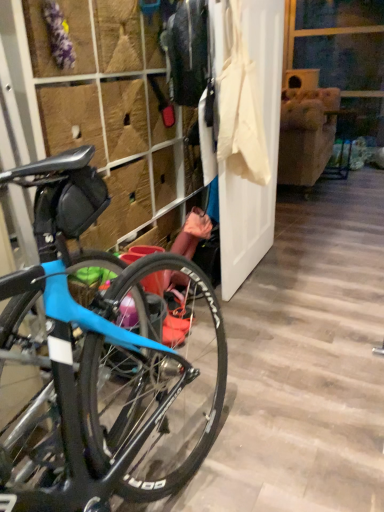
Question: Considering the relative positions of white fabric screen door at center and blue matte bicycle at left in the image provided, is white fabric screen door at center to the left or to the right of blue matte bicycle at left?

Choices:
 (A) left
 (B) right

Answer: (B)

Question: From a real-world perspective, relative to blue matte bicycle at left, is white fabric screen door at center vertically above or below?

Choices:
 (A) below
 (B) above

Answer: (A)

Question: From their relative heights in the image, would you say white fabric screen door at center is taller or shorter than blue matte bicycle at left?

Choices:
 (A) short
 (B) tall

Answer: (A)

Question: From a real-world perspective, relative to white fabric screen door at center, is blue matte bicycle at left vertically above or below?

Choices:
 (A) above
 (B) below

Answer: (A)

Question: Is blue matte bicycle at left inside or outside of white fabric screen door at center?

Choices:
 (A) outside
 (B) inside

Answer: (A)

Question: In terms of width, does blue matte bicycle at left look wider or thinner when compared to white fabric screen door at center?

Choices:
 (A) thin
 (B) wide

Answer: (B)

Question: From the image's perspective, is blue matte bicycle at left above or below white fabric screen door at center?

Choices:
 (A) above
 (B) below

Answer: (B)